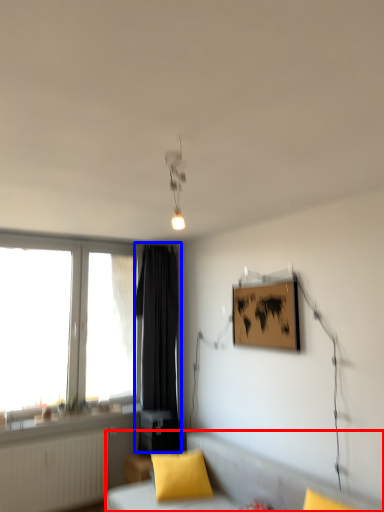
Question: Which object appears farthest to the camera in this image, furniture (highlighted by a red box) or curtain (highlighted by a blue box)?

Choices:
 (A) furniture
 (B) curtain

Answer: (B)